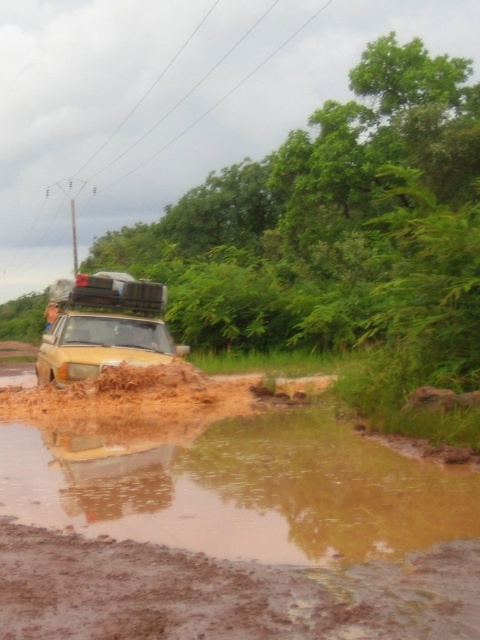
Question: Can you confirm if brown muddy dirt track at lower center is wider than yellow matte car at center?

Choices:
 (A) no
 (B) yes

Answer: (B)

Question: Can you confirm if brown muddy dirt track at lower center is thinner than yellow matte car at center?

Choices:
 (A) yes
 (B) no

Answer: (B)

Question: Which object appears closest to the camera in this image?

Choices:
 (A) yellow matte car at center
 (B) brown muddy dirt track at lower center

Answer: (B)

Question: Among these points, which one is farthest from the camera?

Choices:
 (A) pos(7,630)
 (B) pos(69,336)

Answer: (B)

Question: Is brown muddy dirt track at lower center closer to camera compared to yellow matte car at center?

Choices:
 (A) yes
 (B) no

Answer: (A)